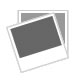
Locate an element on the screen. The width and height of the screenshot is (80, 80). area under picture is located at coordinates click(47, 71).